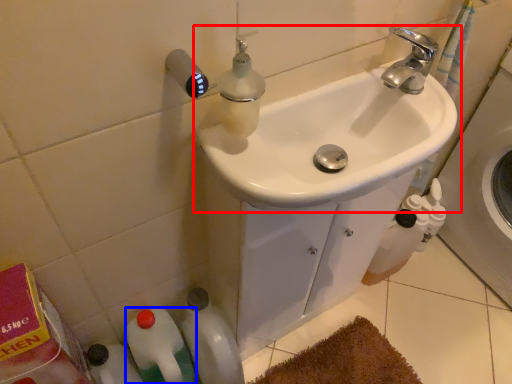
Question: Among these objects, which one is farthest to the camera, sink (highlighted by a red box) or bottle (highlighted by a blue box)?

Choices:
 (A) sink
 (B) bottle

Answer: (B)